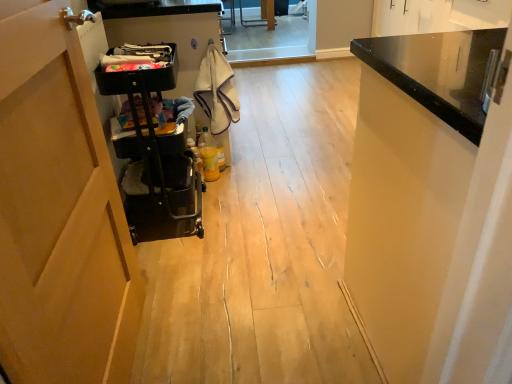
Question: In terms of size, does black fabric laundry at upper center, which is the 1th laundry in front-to-back order, appear bigger or smaller than white cotton towel at center, the 1th laundry positioned from the back?

Choices:
 (A) big
 (B) small

Answer: (B)

Question: Is black fabric laundry at upper center, the second laundry viewed from the back, wider or thinner than white cotton towel at center, which appears as the second laundry when viewed from the left?

Choices:
 (A) wide
 (B) thin

Answer: (A)

Question: Considering the real-world distances, which object is farthest from the black fabric laundry at upper center, the second laundry viewed from the right?

Choices:
 (A) black glossy cabinet at upper right
 (B) white cotton towel at center, the 1th laundry positioned from the back
 (C) black plastic trolley at left

Answer: (A)

Question: Which of these objects is positioned farthest from the black fabric laundry at upper center, which is the 1th laundry in front-to-back order?

Choices:
 (A) black glossy cabinet at upper right
 (B) white cotton towel at center, which is counted as the 1th laundry, starting from the right
 (C) black plastic trolley at left

Answer: (A)